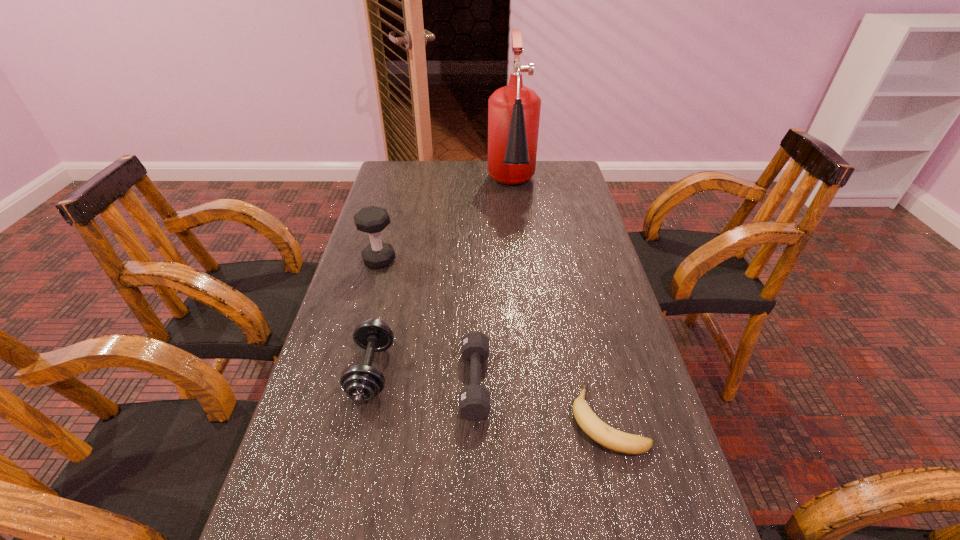
Where is `vacant area that lies between the farthest object and the tallest dumbbell`? This screenshot has height=540, width=960. vacant area that lies between the farthest object and the tallest dumbbell is located at coordinates (445, 224).

The width and height of the screenshot is (960, 540). Find the location of `free space between the rightmost dumbbell and the fourth shortest object`. free space between the rightmost dumbbell and the fourth shortest object is located at coordinates (427, 321).

The width and height of the screenshot is (960, 540). I want to click on vacant space that is in between the third tallest object and the shortest dumbbell, so click(423, 376).

I want to click on vacant area between the second tallest dumbbell and the farthest object, so click(x=442, y=279).

Identify the location of free area in between the third object from right to left and the banana. (541, 401).

Identify the location of free spot between the fire extinguisher and the shortest object. Image resolution: width=960 pixels, height=540 pixels. (x=560, y=303).

Where is `blank region between the tallest object and the banana`? blank region between the tallest object and the banana is located at coordinates (560, 303).

I want to click on free space between the second tallest dumbbell and the farthest object, so click(x=442, y=279).

I want to click on the second closest object relative to the second tallest object, so click(514, 110).

This screenshot has width=960, height=540. What are the coordinates of `the closest object to the banana` in the screenshot? It's located at (474, 400).